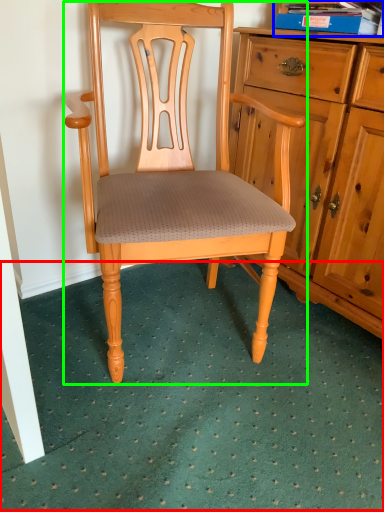
Question: Which object is positioned closest to doormat (highlighted by a red box)? Select from book (highlighted by a blue box) and chair (highlighted by a green box).

Choices:
 (A) book
 (B) chair

Answer: (B)